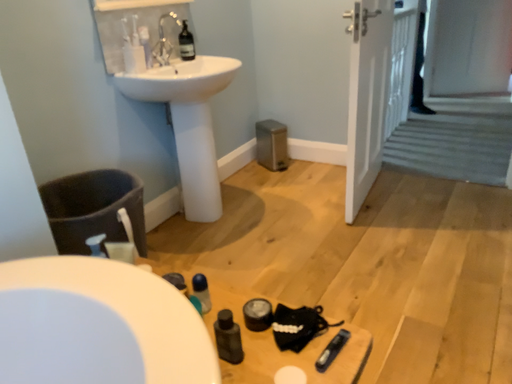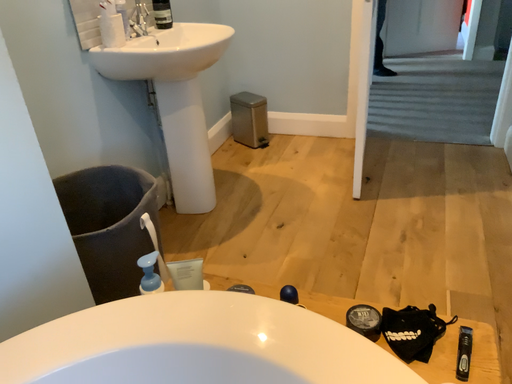
Question: How did the camera likely rotate when shooting the video?

Choices:
 (A) rotated right
 (B) rotated left

Answer: (A)